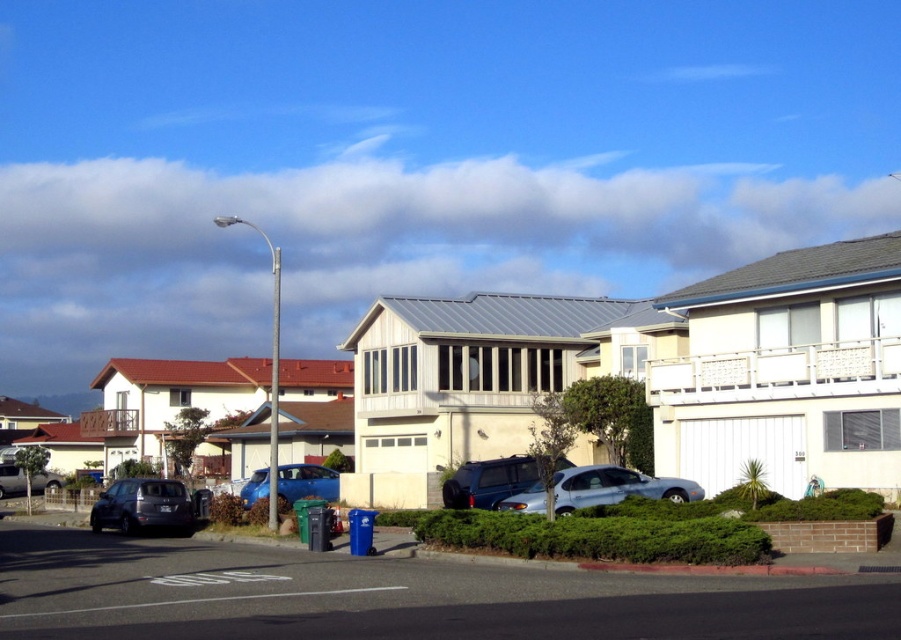
Question: Does matte gray suv at lower left have a smaller size compared to matte silver suv at lower left?

Choices:
 (A) no
 (B) yes

Answer: (B)

Question: Which point is closer to the camera?

Choices:
 (A) (452, 488)
 (B) (281, 468)
 (C) (21, 493)

Answer: (A)

Question: Which point is farther from the camera taking this photo?

Choices:
 (A) (694, 486)
 (B) (314, 481)
 (C) (139, 496)

Answer: (B)

Question: Is matte gray suv at lower left above matte silver suv at lower left?

Choices:
 (A) yes
 (B) no

Answer: (A)

Question: Can you confirm if satin silver car at center is smaller than satin blue suv at center?

Choices:
 (A) no
 (B) yes

Answer: (B)

Question: Among these objects, which one is farthest from the camera?

Choices:
 (A) matte gray suv at lower left
 (B) blue metallic car at center
 (C) satin silver car at center

Answer: (B)